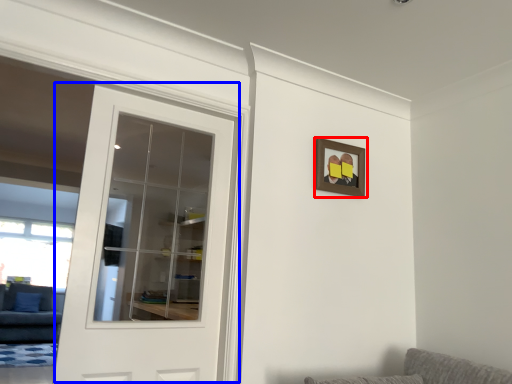
Question: Which point is closer to the camera, picture frame (highlighted by a red box) or door (highlighted by a blue box)?

Choices:
 (A) picture frame
 (B) door

Answer: (B)